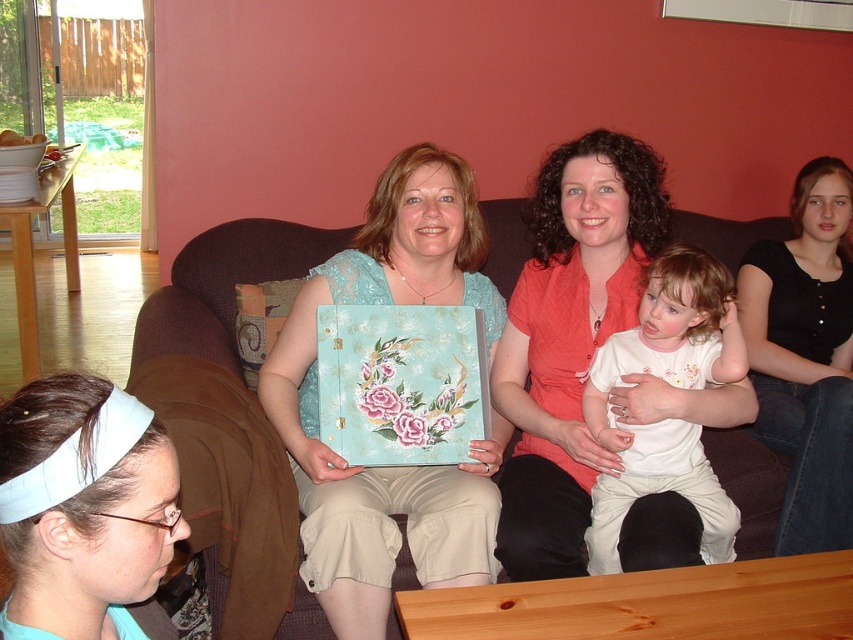
Does brown fabric couch at center appear on the right side of white cotton shirt at center?

In fact, brown fabric couch at center is to the left of white cotton shirt at center.

Is point (276, 220) positioned before point (675, 381)?

No, (276, 220) is further to viewer.

Between point (251, 227) and point (604, 404), which one is positioned behind?

The point (251, 227) is more distant.

Locate an element on the screen. The height and width of the screenshot is (640, 853). brown fabric couch at center is located at coordinates (223, 285).

Which is in front, point (260, 266) or point (825, 276)?

Point (260, 266) is in front.

Where is `brown fabric couch at center`? brown fabric couch at center is located at coordinates point(223,285).

Is point (509, 221) closer to camera compared to point (839, 298)?

Yes, it is.

The width and height of the screenshot is (853, 640). I want to click on brown fabric couch at center, so click(x=223, y=285).

How far apart are matte teal fabric album at center and white fabric headband at lower left?

matte teal fabric album at center is 34.40 inches from white fabric headband at lower left.

Is matte teal fabric album at center bigger than white fabric headband at lower left?

Yes, matte teal fabric album at center is bigger than white fabric headband at lower left.

Which is in front, point (323, 582) or point (44, 628)?

Point (44, 628) is in front.

Where is `matte teal fabric album at center`? Image resolution: width=853 pixels, height=640 pixels. matte teal fabric album at center is located at coordinates (392, 467).